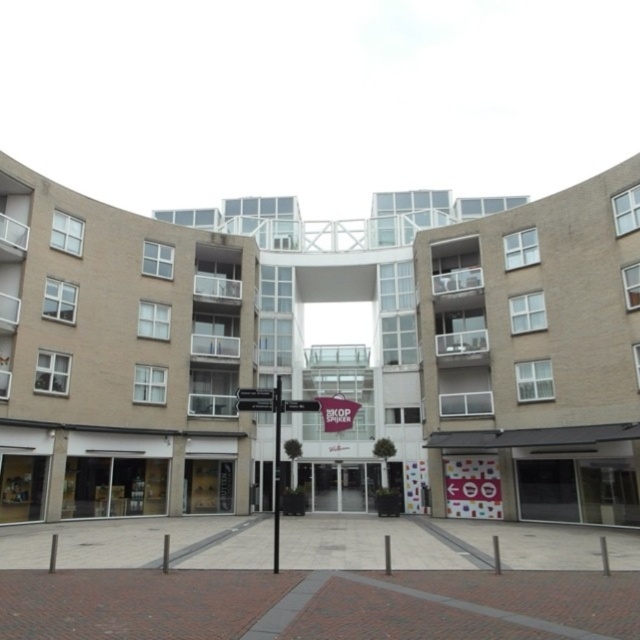
Who is more distant from viewer, (518, 246) or (257, 404)?

The point (518, 246) is behind.

Is beige brick building at center smaller than black metal signpost at center?

No, beige brick building at center is not smaller than black metal signpost at center.

Between point (532, 392) and point (236, 397), which one is positioned behind?

Positioned behind is point (236, 397).

Locate an element on the screen. This screenshot has height=640, width=640. beige brick building at center is located at coordinates (534, 356).

Who is more forward, (76, 396) or (278, 525)?

Point (278, 525)

Is beige concrete building at left positioned before black metal signpost at center?

No, it is not.

What do you see at coordinates (120, 358) in the screenshot? The width and height of the screenshot is (640, 640). I see `beige concrete building at left` at bounding box center [120, 358].

The width and height of the screenshot is (640, 640). In order to click on beige concrete building at left in this screenshot , I will do `click(120, 358)`.

Between beige concrete building at left and black metal pole at center, which one appears on the right side from the viewer's perspective?

black metal pole at center

Based on the photo, is beige concrete building at left shorter than black metal pole at center?

No.

Who is more forward, (188, 406) or (275, 472)?

Positioned in front is point (188, 406).

Identify the location of beige concrete building at left. The width and height of the screenshot is (640, 640). tap(120, 358).